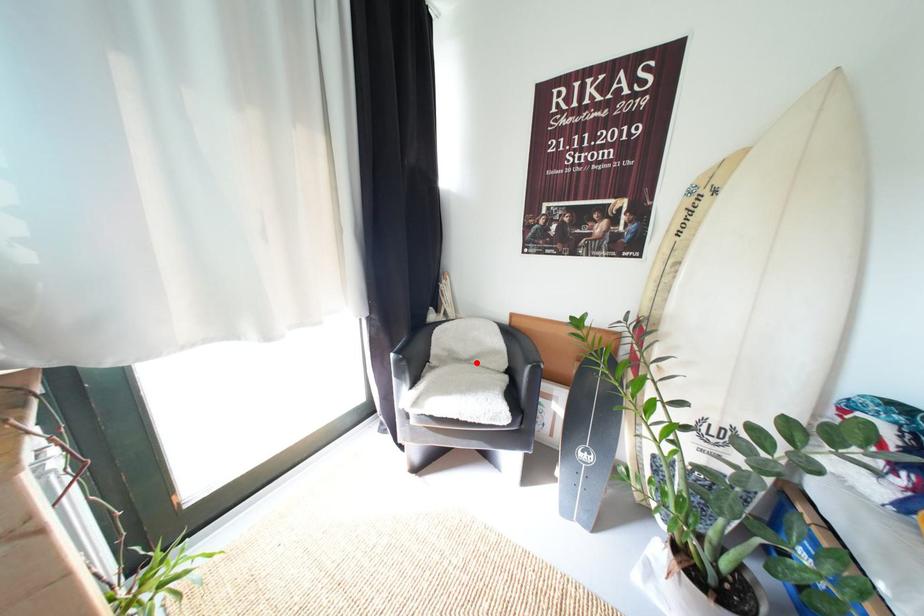
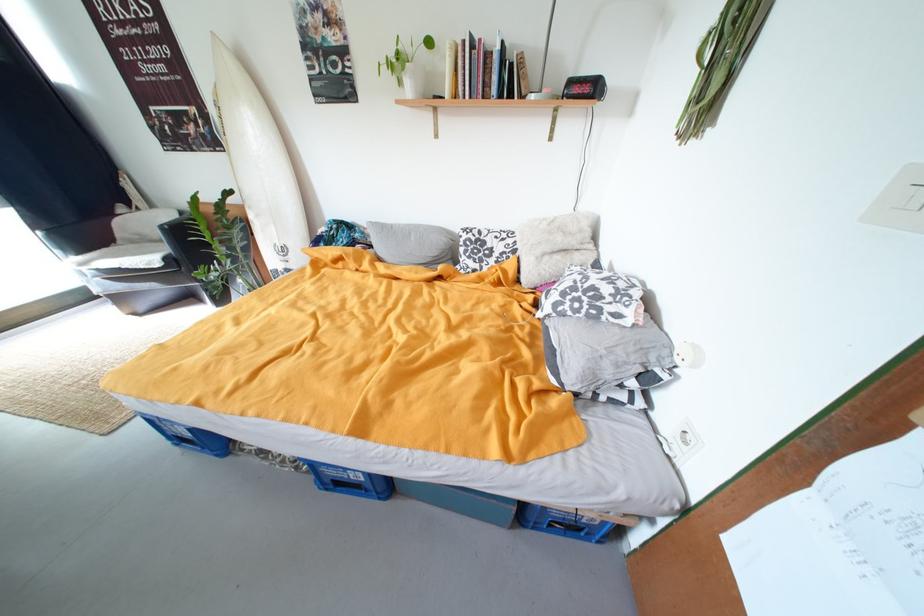
The point at the highlighted location is marked in the first image. Where is the corresponding point in the second image?

(169, 243)